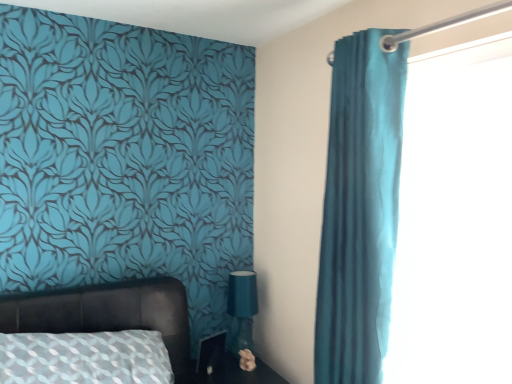
Question: Is matte black side table at lower center further to camera compared to matte teal fabric at lower center?

Choices:
 (A) no
 (B) yes

Answer: (A)

Question: Does matte black side table at lower center turn towards matte teal fabric at lower center?

Choices:
 (A) no
 (B) yes

Answer: (A)

Question: Would you say matte black side table at lower center is a long distance from matte teal fabric at lower center?

Choices:
 (A) yes
 (B) no

Answer: (B)

Question: Is matte black side table at lower center thinner than matte teal fabric at lower center?

Choices:
 (A) yes
 (B) no

Answer: (B)

Question: Does matte black side table at lower center have a larger size compared to matte teal fabric at lower center?

Choices:
 (A) no
 (B) yes

Answer: (B)

Question: Is matte teal fabric at lower center located within matte black side table at lower center?

Choices:
 (A) no
 (B) yes

Answer: (A)

Question: Does matte teal fabric at lower center have a smaller size compared to fluffy beige flower at lower center?

Choices:
 (A) yes
 (B) no

Answer: (B)

Question: Considering the relative sizes of matte teal fabric at lower center and fluffy beige flower at lower center in the image provided, is matte teal fabric at lower center bigger than fluffy beige flower at lower center?

Choices:
 (A) no
 (B) yes

Answer: (B)

Question: Is matte teal fabric at lower center closer to camera compared to fluffy beige flower at lower center?

Choices:
 (A) yes
 (B) no

Answer: (B)

Question: Considering the relative sizes of matte teal fabric at lower center and fluffy beige flower at lower center in the image provided, is matte teal fabric at lower center thinner than fluffy beige flower at lower center?

Choices:
 (A) no
 (B) yes

Answer: (A)

Question: From a real-world perspective, is matte teal fabric at lower center located beneath fluffy beige flower at lower center?

Choices:
 (A) no
 (B) yes

Answer: (A)

Question: From the image's perspective, would you say matte teal fabric at lower center is shown under fluffy beige flower at lower center?

Choices:
 (A) yes
 (B) no

Answer: (B)

Question: Is teal fabric curtain at right not near teal fabric curtain at right?

Choices:
 (A) yes
 (B) no

Answer: (B)